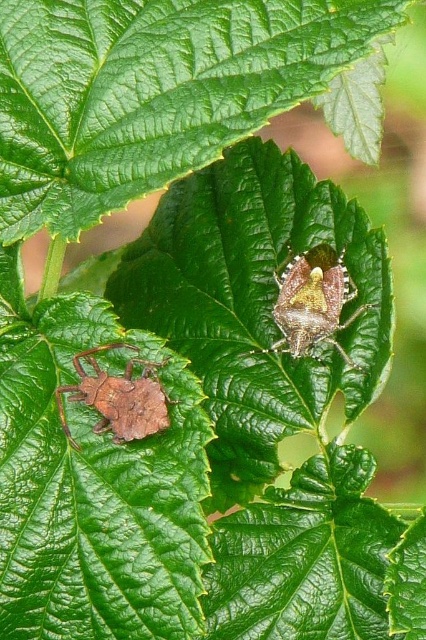
Question: Which point is closer to the camera taking this photo?

Choices:
 (A) click(74, 365)
 (B) click(276, 314)

Answer: (A)

Question: Can you confirm if shiny brown bug at center is wider than matte brown bug at lower left?

Choices:
 (A) no
 (B) yes

Answer: (B)

Question: Among these points, which one is farthest from the camera?

Choices:
 (A) (294, 272)
 (B) (129, 368)

Answer: (A)

Question: Is shiny brown bug at center thinner than matte brown bug at lower left?

Choices:
 (A) no
 (B) yes

Answer: (A)

Question: Among these objects, which one is farthest from the camera?

Choices:
 (A) matte brown bug at lower left
 (B) shiny brown bug at center

Answer: (B)

Question: Does shiny brown bug at center appear on the left side of matte brown bug at lower left?

Choices:
 (A) yes
 (B) no

Answer: (B)